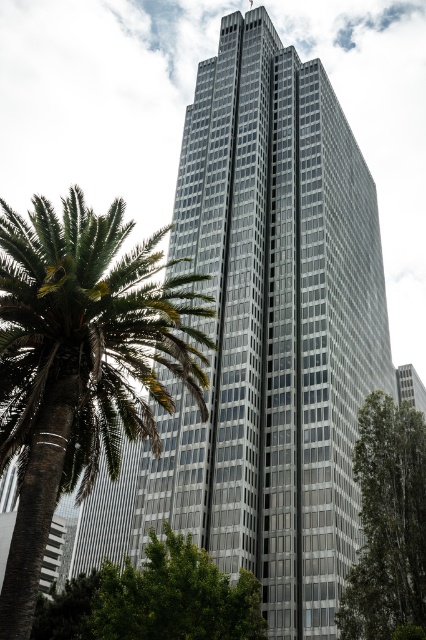
You are standing in front of the skyscraper and want to take a photo of the green leafy palm tree at left. Where should you position yourself to ensure the palm tree is centered in your camera viewfinder?

To center the green leafy palm tree at left in your camera viewfinder, position yourself directly in front of the palm tree at the coordinates corresponding to its 2D location point at (80, 364).

You are standing in front of the skyscraper and notice two points marked on the facade. The first point is at coordinates point (x=345, y=612) and the second is at point (x=155, y=612). Which of these two points is closer to your current position?

Point (x=345, y=612) is closer to your current position because it is further to the viewer than point (x=155, y=612).